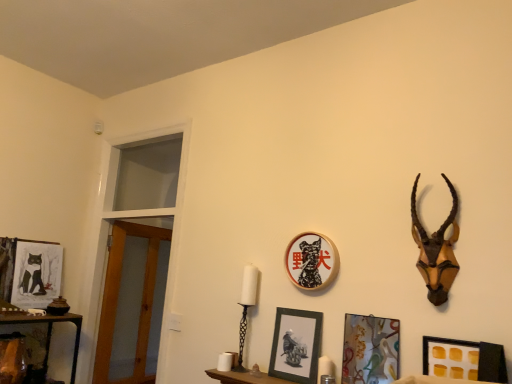
Question: Is matte wood shelf at lower center next to matte black picture frame at left, which is the fifth picture frame from right to left?

Choices:
 (A) no
 (B) yes

Answer: (A)

Question: Is matte wood shelf at lower center shorter than matte black picture frame at left, the 1th picture frame from the back?

Choices:
 (A) no
 (B) yes

Answer: (B)

Question: Is matte wood shelf at lower center aimed at matte black picture frame at left, the 1th picture frame from the back?

Choices:
 (A) yes
 (B) no

Answer: (B)

Question: From a real-world perspective, is matte wood shelf at lower center physically below matte black picture frame at left, which is the fifth picture frame from right to left?

Choices:
 (A) no
 (B) yes

Answer: (B)

Question: Is matte black picture frame at left, marked as the fifth picture frame in a front-to-back arrangement, at the back of matte wood shelf at lower center?

Choices:
 (A) yes
 (B) no

Answer: (B)

Question: Considering the positions of point (420, 269) and point (283, 370), is point (420, 269) closer or farther from the camera than point (283, 370)?

Choices:
 (A) closer
 (B) farther

Answer: (A)

Question: Relative to matte black picture frame at center, placed as the second picture frame when sorted from left to right, is brown wooden antelope head at upper right in front or behind?

Choices:
 (A) behind
 (B) front

Answer: (B)

Question: Considering the positions of brown wooden antelope head at upper right and matte black picture frame at center, which ranks as the 4th picture frame in right-to-left order, in the image, is brown wooden antelope head at upper right wider or thinner than matte black picture frame at center, which ranks as the 4th picture frame in right-to-left order,?

Choices:
 (A) thin
 (B) wide

Answer: (B)

Question: From a real-world perspective, is brown wooden antelope head at upper right above or below matte black picture frame at center, which ranks as the 4th picture frame in right-to-left order?

Choices:
 (A) below
 (B) above

Answer: (B)

Question: Is brown wooden antelope head at upper right in front of or behind matte black picture frame at center, positioned as the third picture frame in left-to-right order, in the image?

Choices:
 (A) front
 (B) behind

Answer: (A)

Question: Is brown wooden antelope head at upper right inside or outside of matte black picture frame at center, which is the 3th picture frame from right to left?

Choices:
 (A) outside
 (B) inside

Answer: (A)

Question: In the image, is brown wooden antelope head at upper right on the left side or the right side of matte black picture frame at center, acting as the 2th picture frame starting from the back?

Choices:
 (A) right
 (B) left

Answer: (A)

Question: Looking at their shapes, would you say brown wooden antelope head at upper right is wider or thinner than matte black picture frame at center, positioned as the third picture frame in left-to-right order?

Choices:
 (A) thin
 (B) wide

Answer: (B)

Question: Is matte black picture frame at center, positioned as the third picture frame in left-to-right order, taller or shorter than matte wood shelf at lower center?

Choices:
 (A) short
 (B) tall

Answer: (B)

Question: Is point (331, 243) positioned closer to the camera than point (208, 375)?

Choices:
 (A) farther
 (B) closer

Answer: (B)